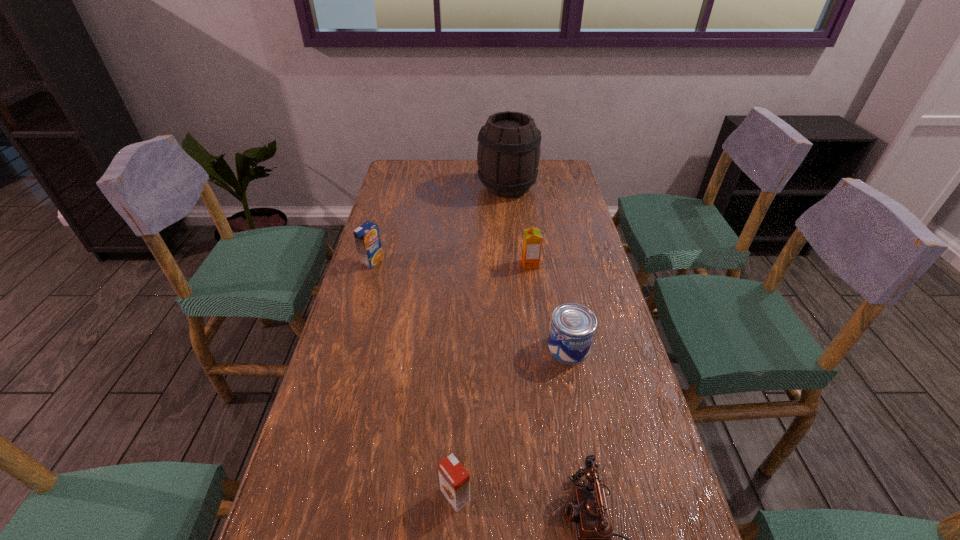
Identify the location of unoccupied area between the nearest orange juice and the wine bucket. The width and height of the screenshot is (960, 540). (481, 341).

I want to click on unoccupied position between the tallest object and the fifth object from right to left, so click(x=481, y=341).

Find the location of a particular element. free point between the can and the rightmost orange juice is located at coordinates tap(549, 306).

You are a GUI agent. You are given a task and a screenshot of the screen. Output one action in this format:
    pyautogui.click(x=<x>, y=<y>)
    Task: Click on the vacant area between the nearest orange juice and the rightmost orange juice
    Image resolution: width=960 pixels, height=540 pixels.
    Given the screenshot: What is the action you would take?
    pyautogui.click(x=492, y=380)

At what (x,y) coordinates should I click in order to perform the action: click on object that stands as the fourth closest to the farthest object. Please return your answer as a coordinate pair (x, y). The width and height of the screenshot is (960, 540). Looking at the image, I should click on (588, 508).

Where is `object that stands as the closest to the can`? This screenshot has width=960, height=540. object that stands as the closest to the can is located at coordinates (532, 239).

Locate an element on the screen. The width and height of the screenshot is (960, 540). orange juice that is the third nearest to the fourth farthest object is located at coordinates (367, 237).

Identify which orange juice is the second closest to the leftmost orange juice. Please provide its 2D coordinates. Your answer should be formatted as a tuple, i.e. [(x, y)], where the tuple contains the x and y coordinates of a point satisfying the conditions above.

[(454, 480)]

At what (x,y) coordinates should I click in order to perform the action: click on free location that satisfies the following two spatial constraints: 1. on the back side of the wine bucket; 2. on the left side of the leftmost object. Please return your answer as a coordinate pair (x, y). Looking at the image, I should click on (394, 187).